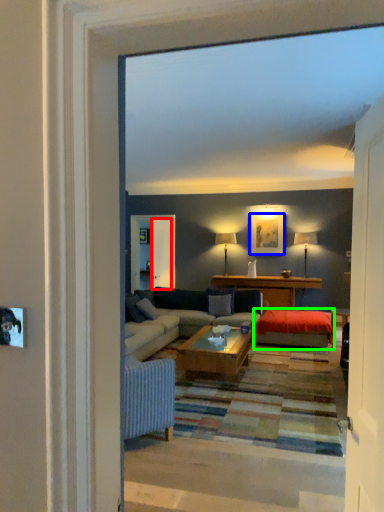
Question: Which object is positioned farthest from screen door (highlighted by a red box)? Select from picture frame (highlighted by a blue box) and wide (highlighted by a green box).

Choices:
 (A) picture frame
 (B) wide

Answer: (B)